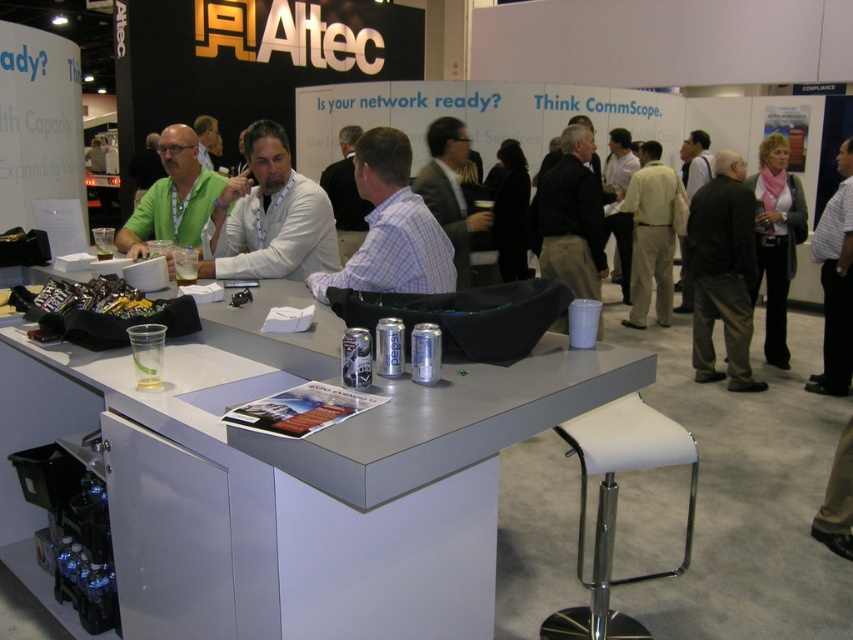
Question: Is white leather stool at lower right behind dark brown pants at right?

Choices:
 (A) no
 (B) yes

Answer: (A)

Question: Which is farther from the white leather stool at lower right?

Choices:
 (A) plaid shirt at center
 (B) beige cotton shirt at center
 (C) striped shirt at center
 (D) matte green shirt at center

Answer: (A)

Question: Which point is farther from the camera taking this photo?

Choices:
 (A) (849, 236)
 (B) (282, 221)
 (C) (770, 221)

Answer: (C)

Question: Can you confirm if white glossy table at center is thinner than plaid shirt at center?

Choices:
 (A) no
 (B) yes

Answer: (A)

Question: Is white checkered shirt at center thinner than black fabric jacket at center?

Choices:
 (A) no
 (B) yes

Answer: (A)

Question: Which object is positioned closest to the pink fabric scarf at right?

Choices:
 (A) dark brown pants at right
 (B) matte gray suit at center
 (C) white leather stool at lower right

Answer: (A)